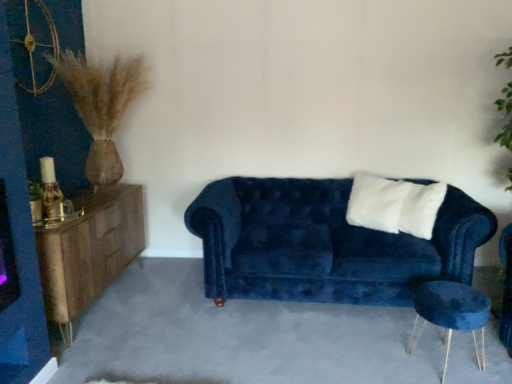
The image size is (512, 384). Find the location of `free space between velvet blue couch at center and velvet blue side table at lower right`. free space between velvet blue couch at center and velvet blue side table at lower right is located at coordinates (337, 334).